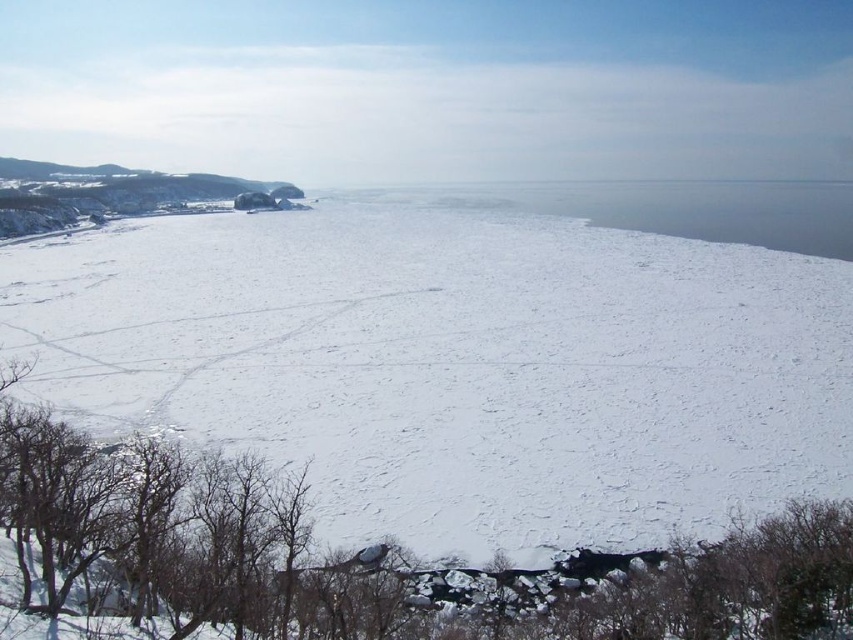
What do you see at coordinates (456, 364) in the screenshot?
I see `white matte snow at center` at bounding box center [456, 364].

How far apart are white matte snow at center and transparent ice at center?

white matte snow at center is 475.35 feet from transparent ice at center.

In order to click on white matte snow at center in this screenshot , I will do `click(456, 364)`.